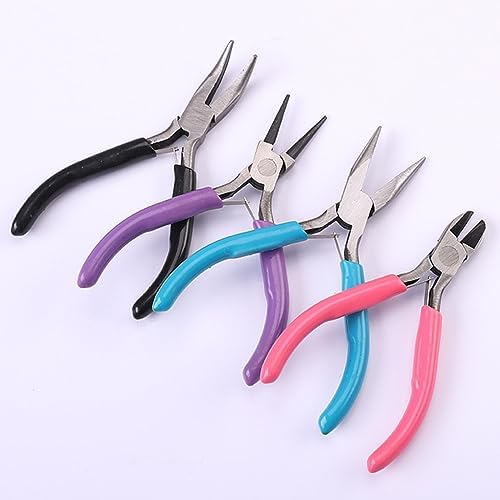
You are a GUI agent. You are given a task and a screenshot of the screen. Output one action in this format:
    pyautogui.click(x=<x>, y=<y>)
    Task: Click on the black handles
    
    Given the screenshot: What is the action you would take?
    pyautogui.click(x=122, y=161), pyautogui.click(x=187, y=237)